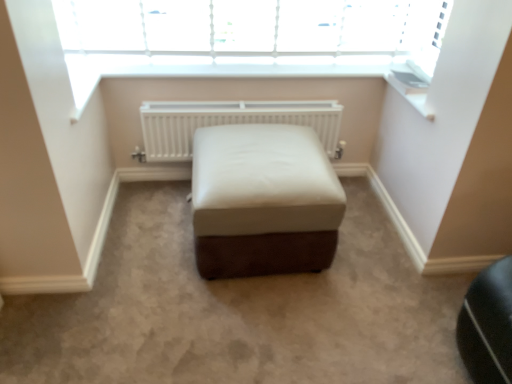
Question: Is white plastic window sill at upper right facing towards white matte radiator at center?

Choices:
 (A) yes
 (B) no

Answer: (B)

Question: Can you confirm if white plastic window sill at upper right is thinner than white matte radiator at center?

Choices:
 (A) yes
 (B) no

Answer: (B)

Question: Considering the relative sizes of white plastic window sill at upper right and white matte radiator at center in the image provided, is white plastic window sill at upper right smaller than white matte radiator at center?

Choices:
 (A) no
 (B) yes

Answer: (B)

Question: Is white plastic window sill at upper right further to camera compared to white matte radiator at center?

Choices:
 (A) no
 (B) yes

Answer: (A)

Question: From the image's perspective, is white plastic window sill at upper right located above white matte radiator at center?

Choices:
 (A) yes
 (B) no

Answer: (A)

Question: Can you confirm if white plastic window sill at upper right is wider than white matte radiator at center?

Choices:
 (A) yes
 (B) no

Answer: (A)

Question: Is white plastic window sill at upper right oriented towards white leather ottoman at center?

Choices:
 (A) no
 (B) yes

Answer: (A)

Question: Considering the relative sizes of white plastic window sill at upper right and white leather ottoman at center in the image provided, is white plastic window sill at upper right bigger than white leather ottoman at center?

Choices:
 (A) yes
 (B) no

Answer: (B)

Question: From a real-world perspective, is white plastic window sill at upper right on top of white leather ottoman at center?

Choices:
 (A) yes
 (B) no

Answer: (A)

Question: Can you confirm if white plastic window sill at upper right is smaller than white leather ottoman at center?

Choices:
 (A) yes
 (B) no

Answer: (A)

Question: From a real-world perspective, is white plastic window sill at upper right below white leather ottoman at center?

Choices:
 (A) yes
 (B) no

Answer: (B)

Question: Can you confirm if white plastic window sill at upper right is shorter than white leather ottoman at center?

Choices:
 (A) no
 (B) yes

Answer: (B)

Question: Does white matte radiator at center have a larger size compared to white leather ottoman at center?

Choices:
 (A) no
 (B) yes

Answer: (A)